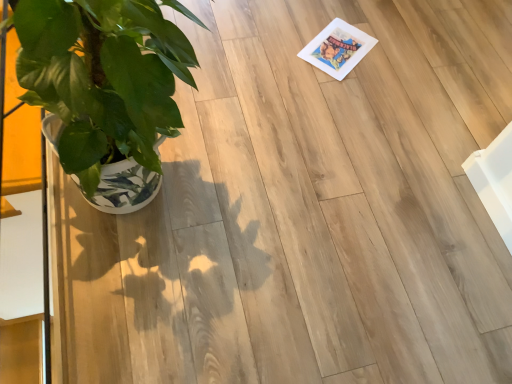
Question: Should I look upward or downward to see green glossy plant at left?

Choices:
 (A) down
 (B) up

Answer: (B)